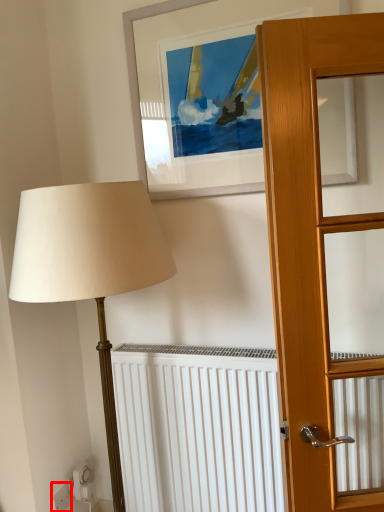
Question: From the image's perspective, what is the correct spatial relationship of electric outlet (annotated by the red box) in relation to picture frame?

Choices:
 (A) below
 (B) above

Answer: (A)